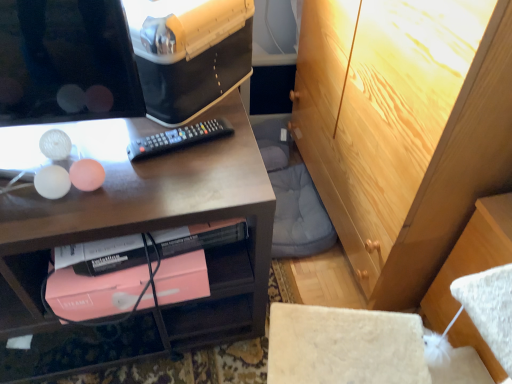
Question: Is pink matte book at lower center shorter than black plastic remote at center?

Choices:
 (A) yes
 (B) no

Answer: (B)

Question: Is the position of pink matte book at lower center less distant than that of black plastic remote at center?

Choices:
 (A) no
 (B) yes

Answer: (B)

Question: From the image's perspective, is pink matte book at lower center below black plastic remote at center?

Choices:
 (A) no
 (B) yes

Answer: (B)

Question: From the image's perspective, is pink matte book at lower center on black plastic remote at center?

Choices:
 (A) yes
 (B) no

Answer: (B)

Question: Can you confirm if pink matte book at lower center is thinner than black plastic remote at center?

Choices:
 (A) yes
 (B) no

Answer: (B)

Question: Is pink matte book at lower center far away from black plastic remote at center?

Choices:
 (A) yes
 (B) no

Answer: (B)

Question: Considering the relative sizes of black plastic remote at center and matte wood desk at upper left in the image provided, is black plastic remote at center shorter than matte wood desk at upper left?

Choices:
 (A) no
 (B) yes

Answer: (B)

Question: Does black plastic remote at center have a larger size compared to matte wood desk at upper left?

Choices:
 (A) no
 (B) yes

Answer: (A)

Question: Considering the relative positions of black plastic remote at center and matte wood desk at upper left in the image provided, is black plastic remote at center to the left of matte wood desk at upper left from the viewer's perspective?

Choices:
 (A) yes
 (B) no

Answer: (B)

Question: From a real-world perspective, is black plastic remote at center located higher than matte wood desk at upper left?

Choices:
 (A) no
 (B) yes

Answer: (B)

Question: Is black plastic remote at center at the right side of matte wood desk at upper left?

Choices:
 (A) no
 (B) yes

Answer: (B)

Question: Is black plastic remote at center positioned with its back to matte wood desk at upper left?

Choices:
 (A) no
 (B) yes

Answer: (B)

Question: Is light brown wood cabinet at upper right behind pink matte book at lower center?

Choices:
 (A) yes
 (B) no

Answer: (B)